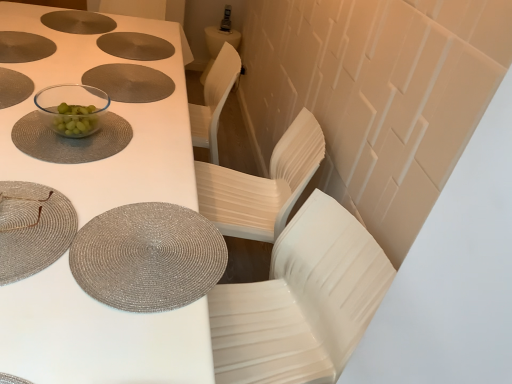
The height and width of the screenshot is (384, 512). I want to click on vacant space in matte silver placemat at center (from a real-world perspective), so click(x=123, y=78).